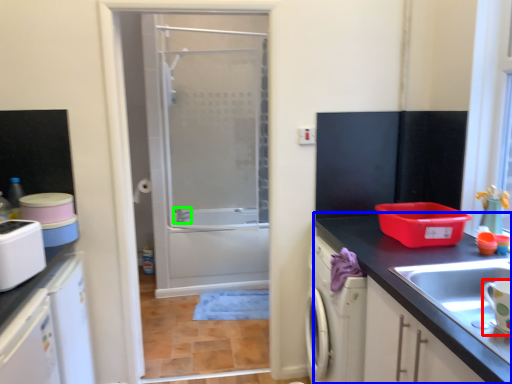
Question: Estimate the real-world distances between objects in this image. Which object is farther from appliance (highlighted by a red box), countertop (highlighted by a blue box) or faucet (highlighted by a green box)?

Choices:
 (A) countertop
 (B) faucet

Answer: (B)